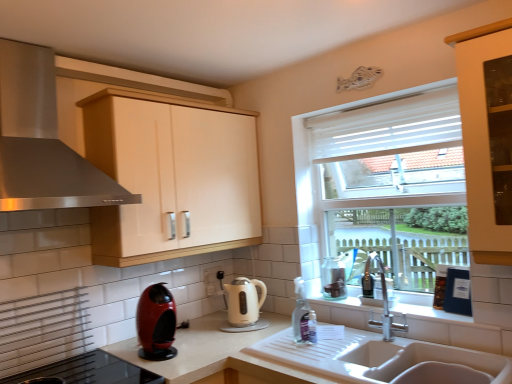
Where is `vacant region above stainless steel range hood at upper left (from a real-world perspective)`? This screenshot has width=512, height=384. vacant region above stainless steel range hood at upper left (from a real-world perspective) is located at coordinates (55, 26).